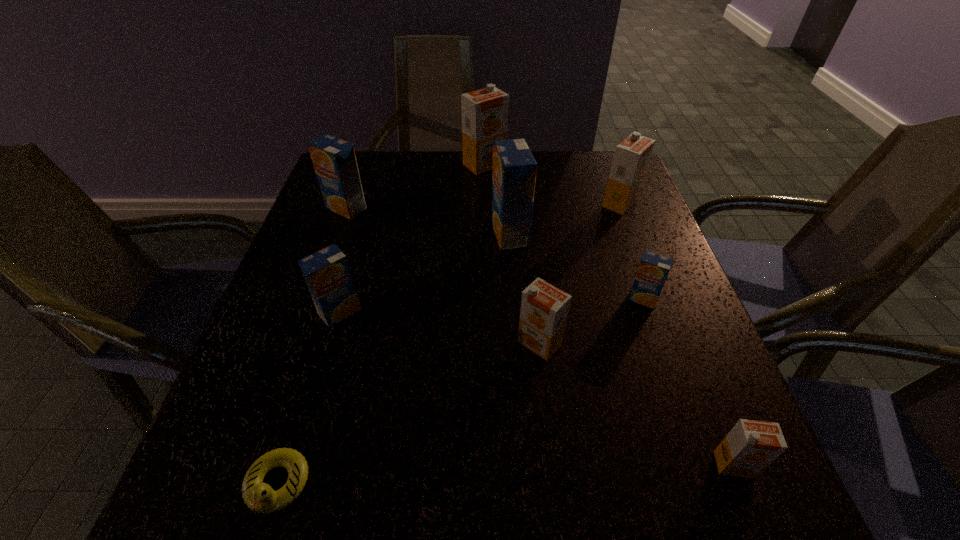
The width and height of the screenshot is (960, 540). In order to click on the shortest object in this screenshot , I will do `click(260, 497)`.

You are a GUI agent. You are given a task and a screenshot of the screen. Output one action in this format:
    pyautogui.click(x=<x>, y=<y>)
    Task: Click on the duckling
    Image resolution: width=960 pixels, height=540 pixels.
    Given the screenshot: What is the action you would take?
    pyautogui.click(x=260, y=497)

Where is `free space located on the right of the farthest orange orange juice`? Image resolution: width=960 pixels, height=540 pixels. free space located on the right of the farthest orange orange juice is located at coordinates (607, 165).

Locate an element on the screen. Image resolution: width=960 pixels, height=540 pixels. free location located on the front of the biggest blue orange_juice is located at coordinates (513, 278).

The width and height of the screenshot is (960, 540). In order to click on vacant space located 0.110m on the back of the second biggest blue orange_juice in this screenshot , I will do click(x=358, y=174).

You are a GUI agent. You are given a task and a screenshot of the screen. Output one action in this format:
    pyautogui.click(x=<x>, y=<y>)
    Task: Click on the free space located on the back of the third smallest orange orange juice
    The image size is (960, 540).
    Given the screenshot: What is the action you would take?
    pyautogui.click(x=606, y=165)

Locate an element on the screen. The height and width of the screenshot is (540, 960). vacant space positioned 0.390m on the right of the second smallest blue orange_juice is located at coordinates (557, 312).

You are a GUI agent. You are given a task and a screenshot of the screen. Output one action in this format:
    pyautogui.click(x=<x>, y=<y>)
    Task: Click on the blank space located 0.200m on the front of the third biggest orange orange juice
    
    Given the screenshot: What is the action you would take?
    pyautogui.click(x=555, y=475)

Where is `free space located 0.200m on the front of the rightmost blue orange_juice`? This screenshot has height=540, width=960. free space located 0.200m on the front of the rightmost blue orange_juice is located at coordinates (678, 399).

Locate an element on the screen. free spot located 0.240m on the left of the nearest orange orange juice is located at coordinates (557, 464).